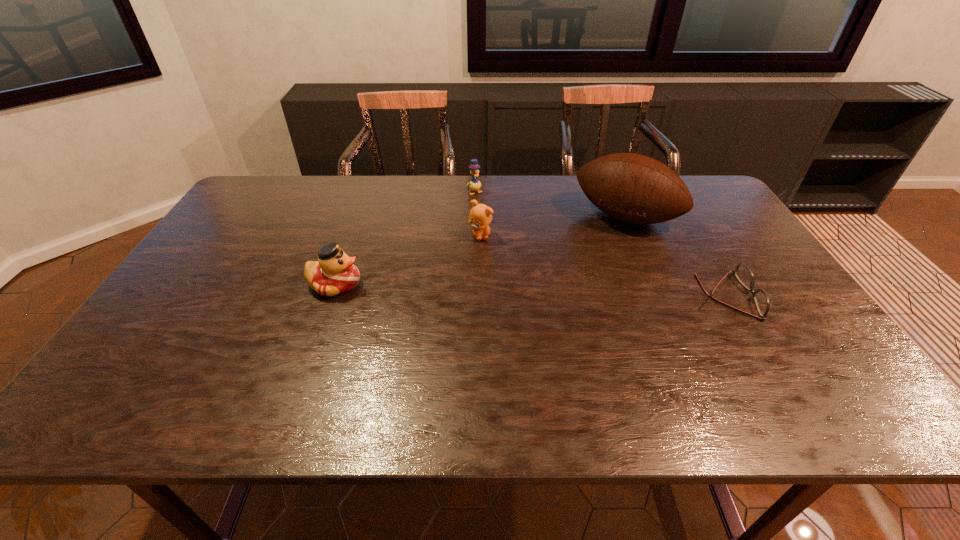
This screenshot has height=540, width=960. In order to click on vacant area situated on the face of the duckling, where the monocle is placed in this screenshot , I will do `click(508, 235)`.

Find the location of a particular element. This screenshot has height=540, width=960. free location located 0.330m on the face of the duckling, where the monocle is placed is located at coordinates (519, 251).

Where is `vacant space situated on the face of the duckling, where the monocle is placed`? vacant space situated on the face of the duckling, where the monocle is placed is located at coordinates (522, 254).

Locate an element on the screen. Image resolution: width=960 pixels, height=540 pixels. free location located 0.120m on the face of the teddy bear is located at coordinates (491, 268).

Where is `free region located 0.320m on the face of the teddy bear`? The image size is (960, 540). free region located 0.320m on the face of the teddy bear is located at coordinates (507, 321).

Where is `free space located on the face of the teddy bear`? The height and width of the screenshot is (540, 960). free space located on the face of the teddy bear is located at coordinates (511, 333).

This screenshot has height=540, width=960. What are the coordinates of `football located in the far edge section of the desktop` in the screenshot? It's located at (634, 188).

What are the coordinates of `duckling situated at the far edge` in the screenshot? It's located at (475, 184).

Locate an element on the screen. object located at the right edge is located at coordinates (742, 272).

This screenshot has height=540, width=960. In order to click on free point at the far edge in this screenshot , I will do `click(382, 190)`.